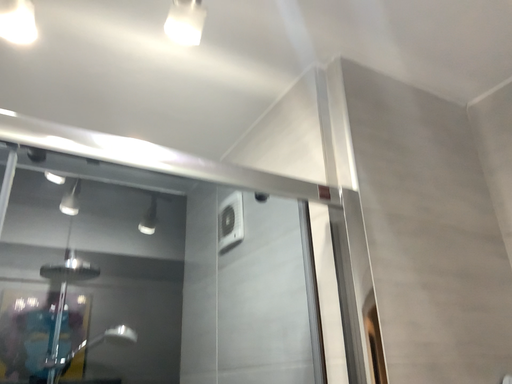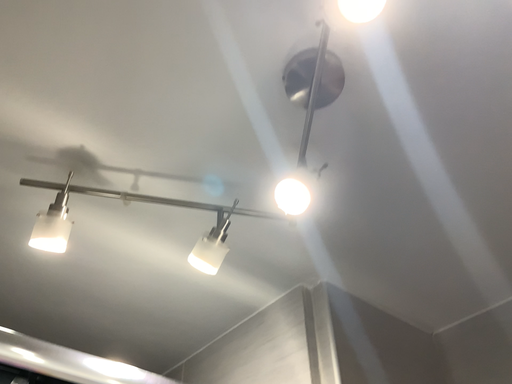
Question: How did the camera likely rotate when shooting the video?

Choices:
 (A) rotated upward
 (B) rotated downward

Answer: (A)